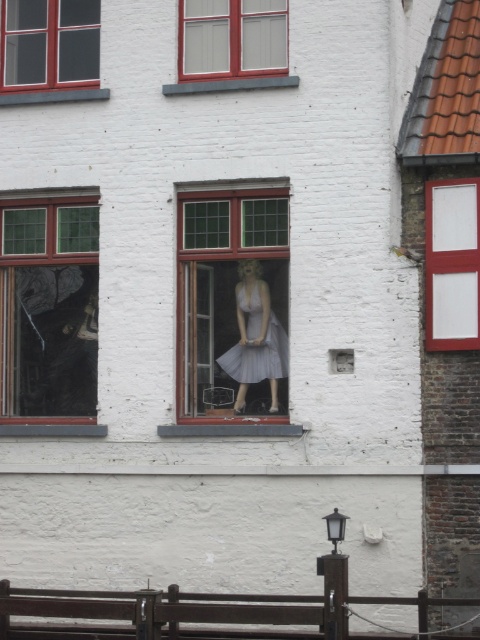
You are standing in front of the white brick building and notice two points marked on the building. The first point is at coordinates point (43, 332) and the second is at point (257, 12). Which point is closer to you?

Point (43, 332) is closer to you because it is further to the viewer than point (257, 12).